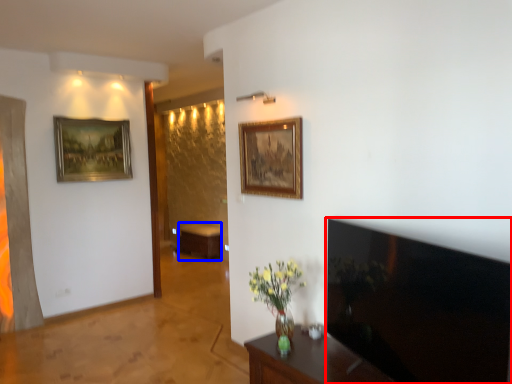
Question: Which object is further to the camera taking this photo, television (highlighted by a red box) or table (highlighted by a blue box)?

Choices:
 (A) television
 (B) table

Answer: (B)